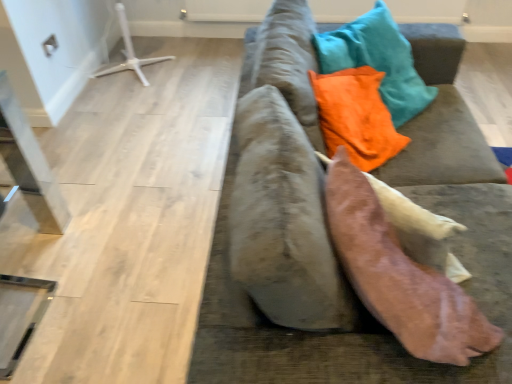
The height and width of the screenshot is (384, 512). What do you see at coordinates (326, 218) in the screenshot? I see `velvet gray couch at center` at bounding box center [326, 218].

Identify the location of velvet gray couch at center. The width and height of the screenshot is (512, 384). (326, 218).

Where is `velvet gray couch at center`? The height and width of the screenshot is (384, 512). velvet gray couch at center is located at coordinates (326, 218).